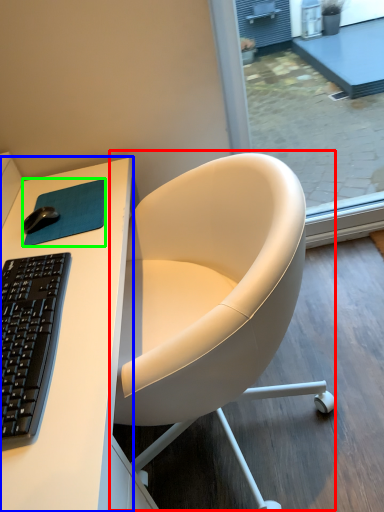
Question: Which is farther away from chair (highlighted by a red box)? desk (highlighted by a blue box) or mousepad (highlighted by a green box)?

Choices:
 (A) desk
 (B) mousepad

Answer: (B)